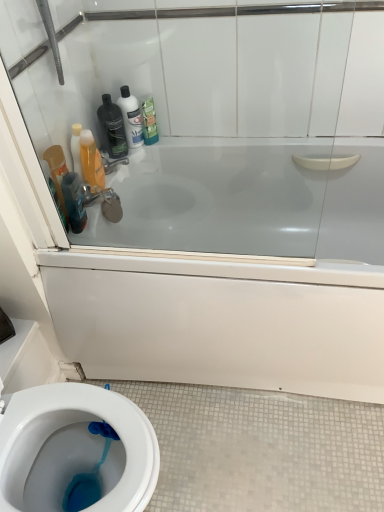
Question: From their relative heights in the image, would you say translucent orange bottle at upper left, the 1th cleaning product in the left-to-right sequence, is taller or shorter than matte silver faucet at upper left?

Choices:
 (A) tall
 (B) short

Answer: (A)

Question: Is translucent orange bottle at upper left, which appears as the 3th cleaning product when viewed from the right, in front of or behind matte silver faucet at upper left in the image?

Choices:
 (A) front
 (B) behind

Answer: (A)

Question: Which object is the closest to the white glossy bathtub at upper center?

Choices:
 (A) translucent plastic bottle at upper center, the second cleaning product from the right
 (B) matte silver faucet at upper left
 (C) translucent orange bottle at upper left, the 1th cleaning product in the left-to-right sequence
 (D) translucent plastic mouthwash at left, which is the 2th mouthwash in left-to-right order
 (E) matte black bottle at upper left

Answer: (D)

Question: Which object is positioned farthest from the translucent plastic bottle at upper center, the second cleaning product from the right?

Choices:
 (A) transparent glass door at upper center
 (B) white glossy bathtub at upper center
 (C) green matte bottle at upper center, arranged as the 3th cleaning product when viewed from the left
 (D) translucent plastic mouthwash at left, acting as the second mouthwash starting from the right
 (E) matte silver faucet at upper left

Answer: (B)